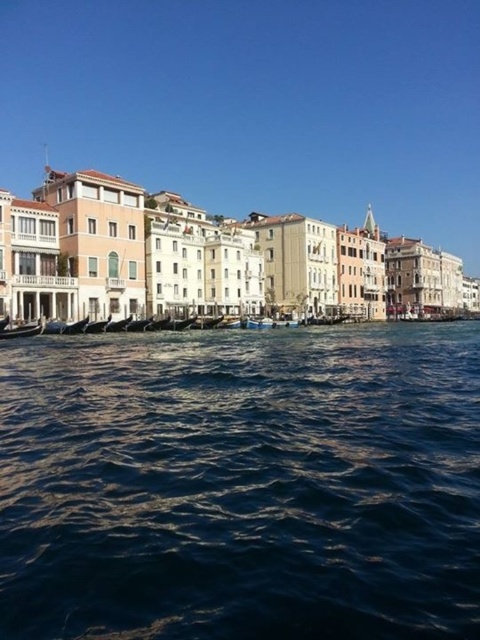
You are standing at the waterfront in Venice and want to reach a specific point marked as point (478, 612). Given that the average walking speed is 3 feet per second, how many seconds will it take to reach that point?

The point (478, 612) is 104.50 feet from the viewer. At an average walking speed of 3 feet per second, it would take approximately 34.83 seconds to reach the point.

You are a tourist in Venice standing on a bridge overlooking the canal. You see the dark blue water at center and the wooden gondola at lower left. Which one is closer to you?

The dark blue water at center is closer to you because it is in front of the wooden gondola at lower left.

You are a tourist in Venice and want to take a photo of the dark blue water at center and the wooden gondola at lower left. Which one should you zoom in on to capture more details?

The wooden gondola at lower left is smaller in size than the dark blue water at center, so you should zoom in on the wooden gondola at lower left to capture more details.